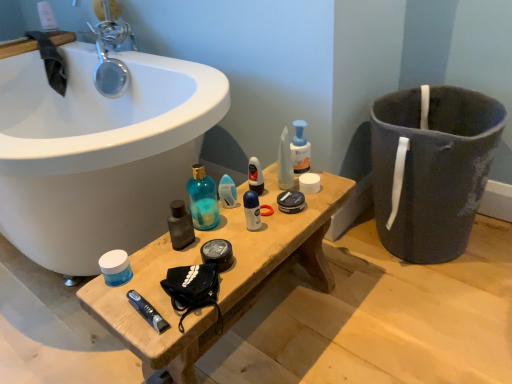
The image size is (512, 384). What are the coordinates of `empty space that is to the right of translucent plastic deodorant at center, the 1th toiletry positioned from the left` in the screenshot? It's located at (281, 196).